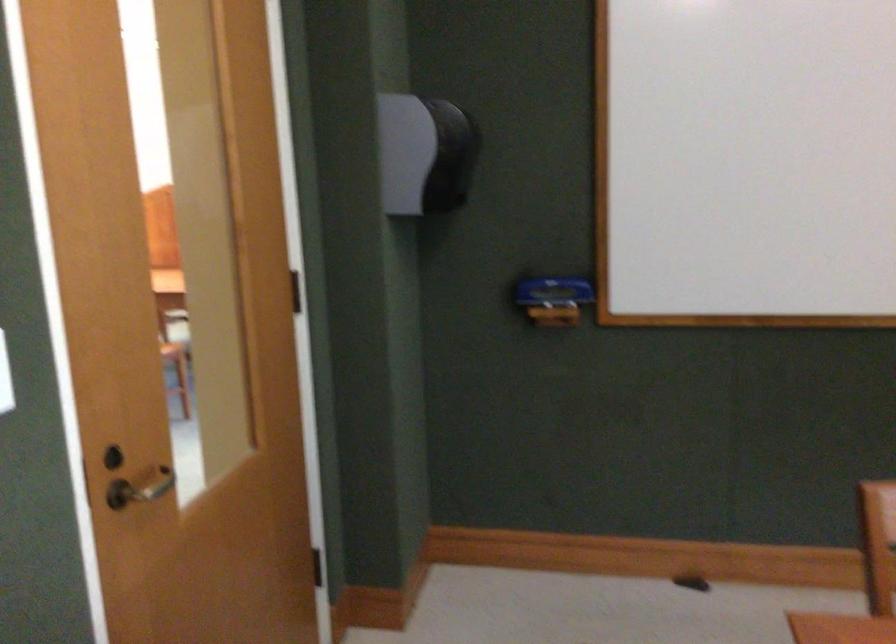
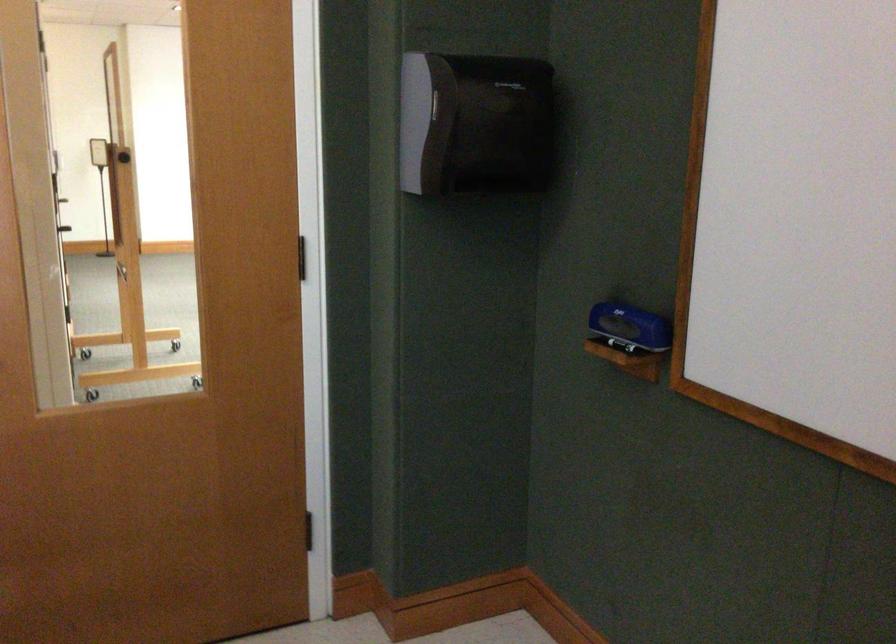
Where in the second image is the point corresponding to point 572,292 from the first image?

(630, 327)